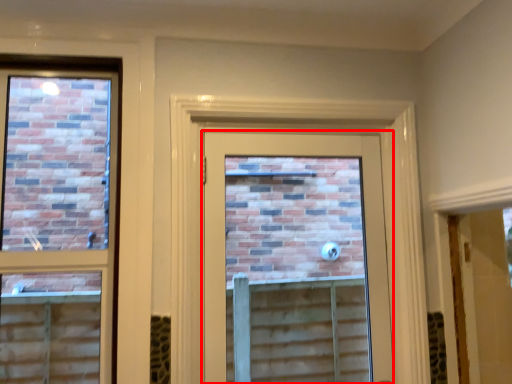
Question: From the image's perspective, where is door (annotated by the red box) located relative to window?

Choices:
 (A) below
 (B) above

Answer: (A)